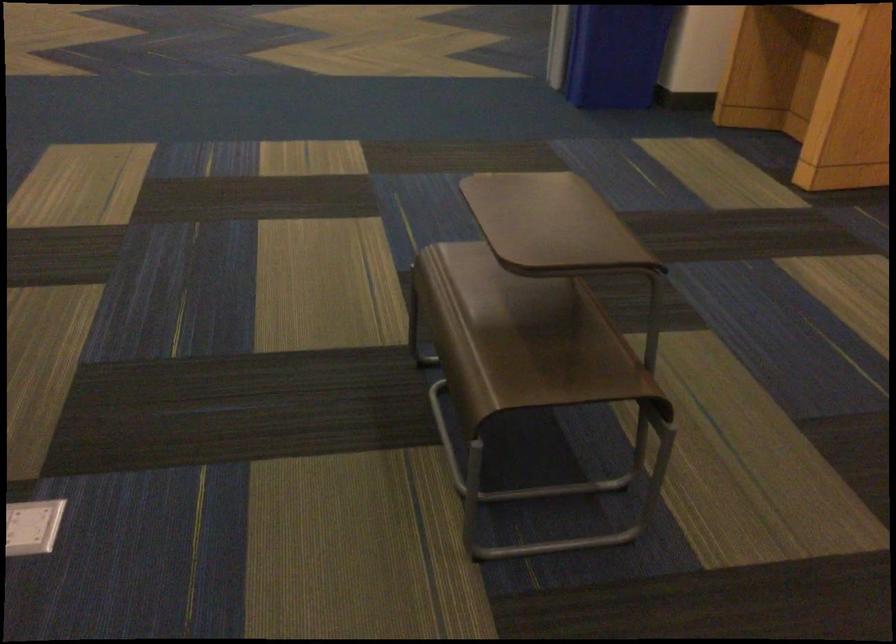
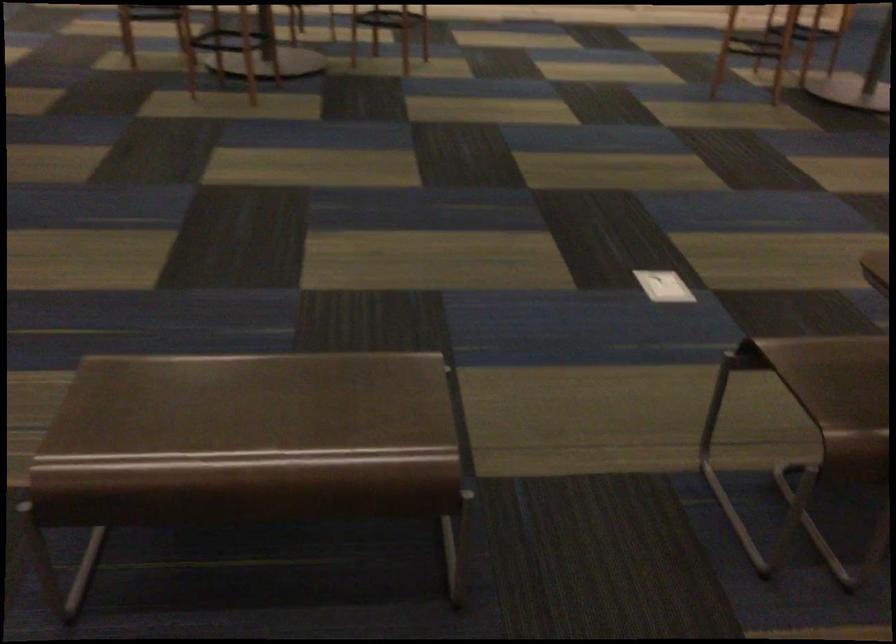
Find the pixel in the second image that matches the point at 524,371 in the first image.

(823, 366)